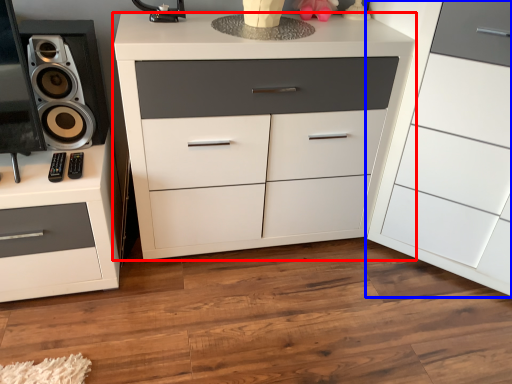
Question: Which point is closer to the camera, chest of drawers (highlighted by a red box) or chest of drawers (highlighted by a blue box)?

Choices:
 (A) chest of drawers
 (B) chest of drawers

Answer: (B)